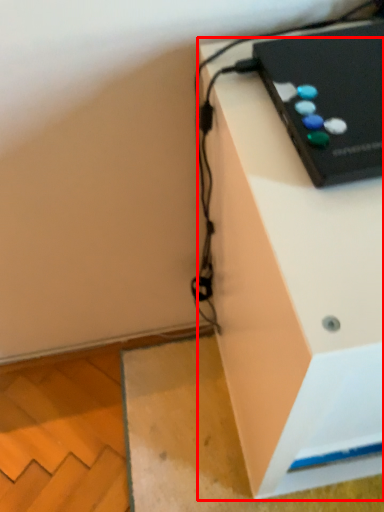
Question: In this image, where is furniture (annotated by the red box) located relative to computer?

Choices:
 (A) left
 (B) right

Answer: (B)